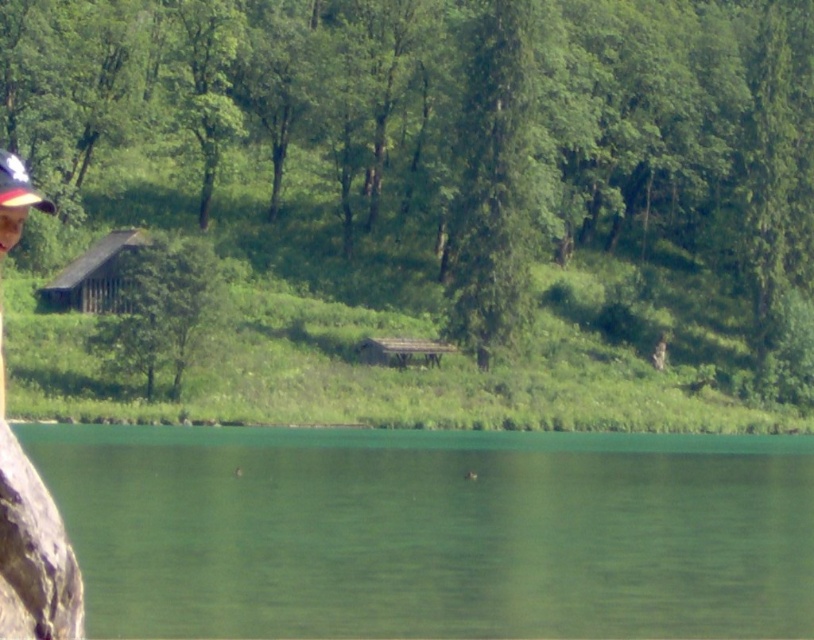
Question: Is green liquid water at lower center to the right of camouflage hat at left from the viewer's perspective?

Choices:
 (A) no
 (B) yes

Answer: (B)

Question: Which is nearer to the green liquid water at lower center?

Choices:
 (A) camouflage hat at left
 (B) white matte baseball cap at upper left

Answer: (A)

Question: Considering the real-world distances, which object is farthest from the green liquid water at lower center?

Choices:
 (A) camouflage hat at left
 (B) white matte baseball cap at upper left

Answer: (B)

Question: Observing the image, what is the correct spatial positioning of green liquid water at lower center in reference to camouflage hat at left?

Choices:
 (A) left
 (B) right

Answer: (B)

Question: Is green liquid water at lower center smaller than white matte baseball cap at upper left?

Choices:
 (A) yes
 (B) no

Answer: (A)

Question: Among these objects, which one is nearest to the camera?

Choices:
 (A) camouflage hat at left
 (B) green liquid water at lower center
 (C) white matte baseball cap at upper left

Answer: (C)